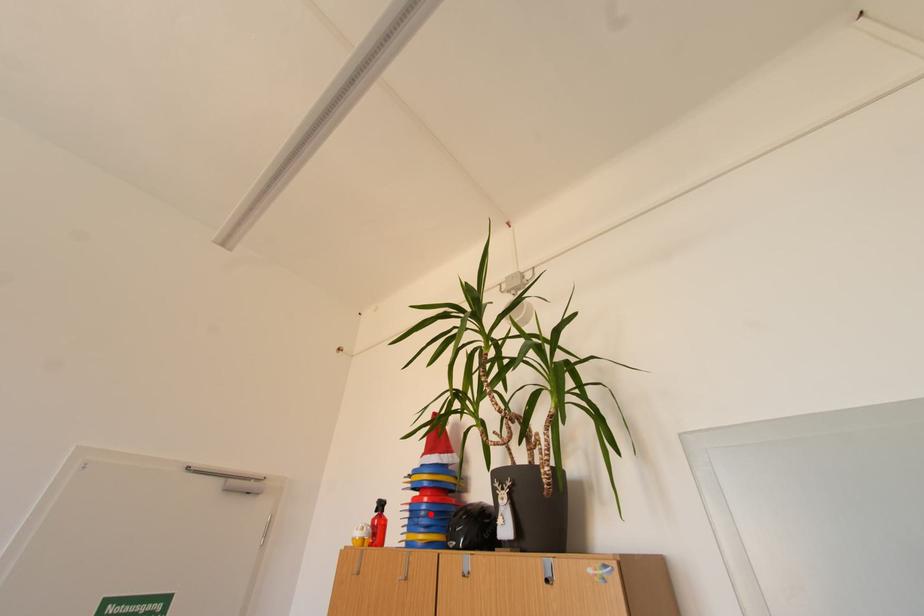
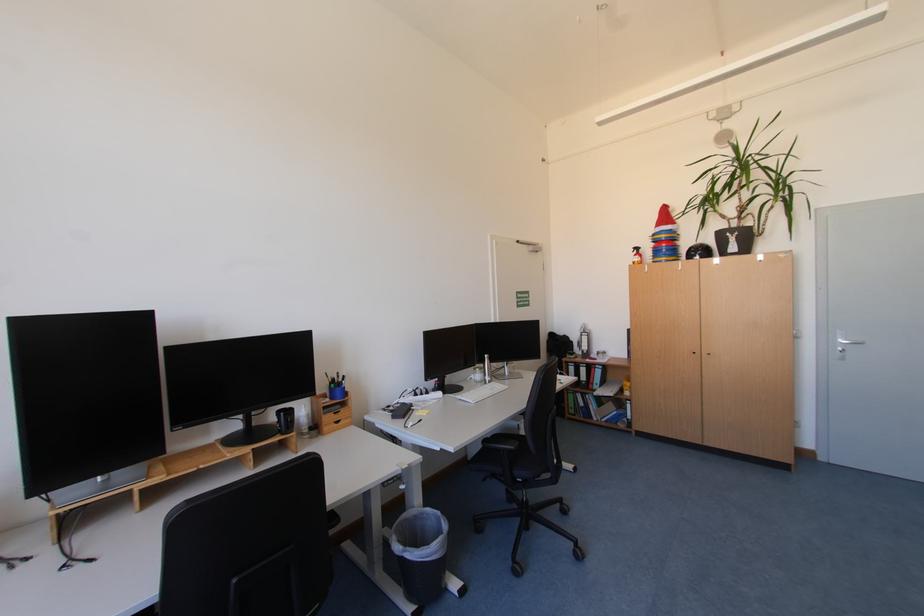
Question: I am providing you with two images of the same scene from different viewpoints. A red point is shown in image1. For the corresponding object point in image2, is it positioned nearer or farther from the camera?

Choices:
 (A) Nearer
 (B) Farther

Answer: (A)